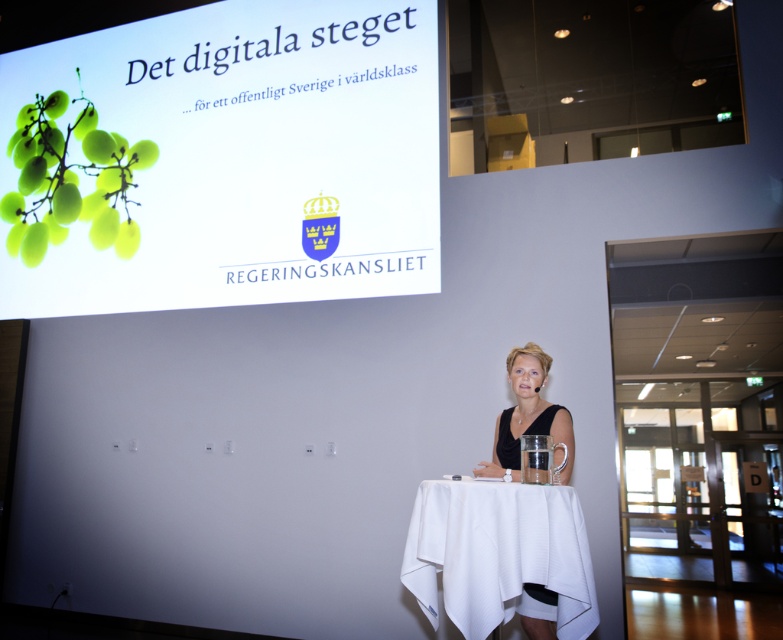
Who is lower down, white paper at upper left or matte black dress at center?

matte black dress at center

Who is more forward, (60, 148) or (533, 380)?

Point (533, 380)

Between point (258, 38) and point (556, 435), which one is positioned behind?

The point (258, 38) is behind.

The image size is (783, 640). I want to click on white paper at upper left, so click(222, 160).

Can you confirm if white paper at upper left is wider than matte black woman at center?

Indeed, white paper at upper left has a greater width compared to matte black woman at center.

Where is `white paper at upper left`? This screenshot has height=640, width=783. white paper at upper left is located at coordinates (222, 160).

Is point (543, 576) closer to viewer compared to point (504, 460)?

Yes, point (543, 576) is in front of point (504, 460).

From the picture: Can you confirm if white cloth-covered table at center is smaller than matte black dress at center?

Incorrect, white cloth-covered table at center is not smaller in size than matte black dress at center.

Which is in front, point (561, 570) or point (533, 380)?

Point (561, 570)

You are a GUI agent. You are given a task and a screenshot of the screen. Output one action in this format:
    pyautogui.click(x=<x>, y=<y>)
    Task: Click on the white cloth-covered table at center
    Image resolution: width=783 pixels, height=640 pixels.
    Given the screenshot: What is the action you would take?
    pyautogui.click(x=498, y=554)